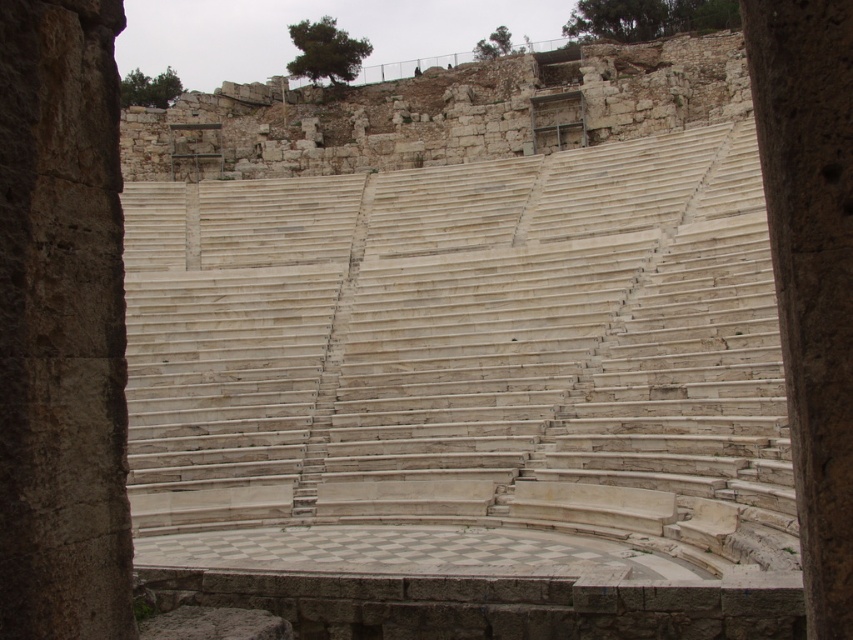
Question: Does smooth stone pillar at left appear over smooth stone pillar at center?

Choices:
 (A) yes
 (B) no

Answer: (A)

Question: Does smooth stone pillar at left appear over smooth stone pillar at center?

Choices:
 (A) no
 (B) yes

Answer: (B)

Question: Among these points, which one is nearest to the camera?

Choices:
 (A) (788, 4)
 (B) (32, 547)

Answer: (A)

Question: Which point appears farthest from the camera in this image?

Choices:
 (A) (32, 480)
 (B) (790, 228)

Answer: (A)

Question: Which point is farther to the camera?

Choices:
 (A) smooth stone pillar at left
 (B) smooth stone pillar at center

Answer: (A)

Question: Is smooth stone pillar at left positioned before smooth stone pillar at center?

Choices:
 (A) no
 (B) yes

Answer: (A)